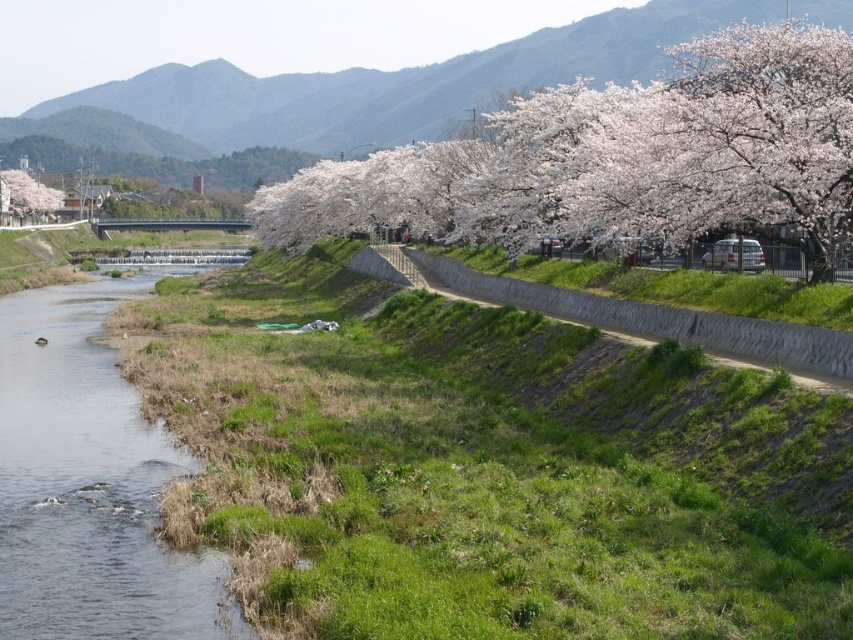
Question: Which point appears farthest from the camera in this image?

Choices:
 (A) (4, 476)
 (B) (1, 176)

Answer: (B)

Question: Can you confirm if white blossoming tree at upper right is positioned below cherry blossom tree at upper left?

Choices:
 (A) no
 (B) yes

Answer: (A)

Question: Which object appears farthest from the camera in this image?

Choices:
 (A) cherry blossom tree at upper left
 (B) clear water at river left
 (C) white blossoming tree at upper right

Answer: (A)

Question: Which object appears farthest from the camera in this image?

Choices:
 (A) cherry blossom tree at upper left
 (B) white blossoming tree at upper right
 (C) clear water at river left

Answer: (A)

Question: Is clear water at river left bigger than cherry blossom tree at upper left?

Choices:
 (A) no
 (B) yes

Answer: (A)

Question: Can you confirm if clear water at river left is positioned above cherry blossom tree at upper left?

Choices:
 (A) yes
 (B) no

Answer: (B)